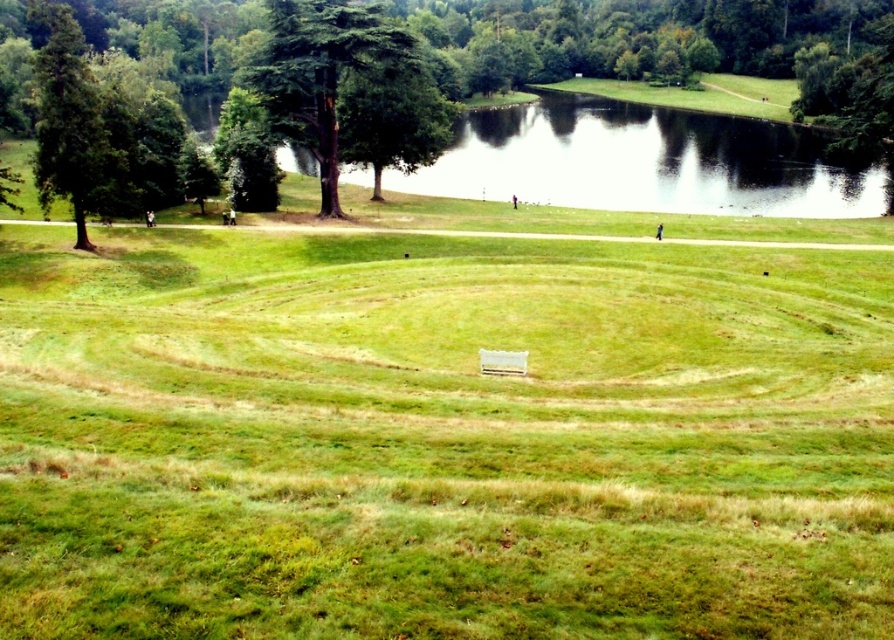
You are standing in the park and want to reach the circular pattern in the grass. If you walk straight from your current position, will you reach the circular pattern before reaching the point located at coordinates point (82, 131)?

The distance between you and point (82, 131) is 58.55 meters. Since the circular pattern is part of the grassy area in front of you, you would reach it before reaching the point (82, 131).

You are standing at the entrance of the park and see the green leafy tree at center and the green matte tree at left. Which tree is closer to your left side?

The green matte tree at left is closer to your left side because it is positioned on the left side of the green leafy tree at center.